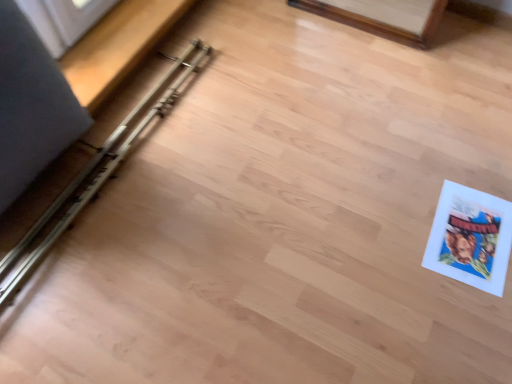
The height and width of the screenshot is (384, 512). I want to click on vacant space underneath white paper comic book at lower right (from a real-world perspective), so click(466, 229).